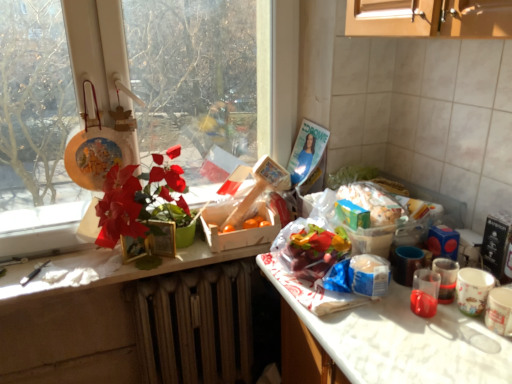
The width and height of the screenshot is (512, 384). I want to click on empty space that is ontop of brown textured radiator at lower center (from a real-world perspective), so click(187, 274).